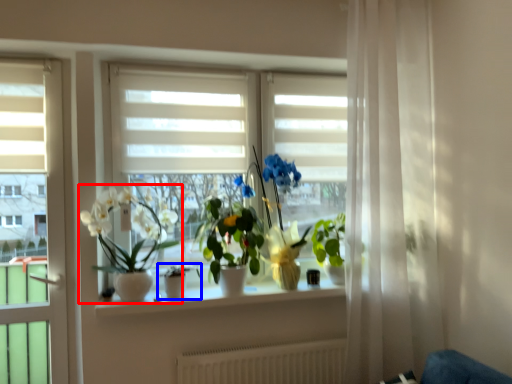
Question: Which object is closer to the camera taking this photo, houseplant (highlighted by a red box) or houseplant (highlighted by a blue box)?

Choices:
 (A) houseplant
 (B) houseplant

Answer: (A)